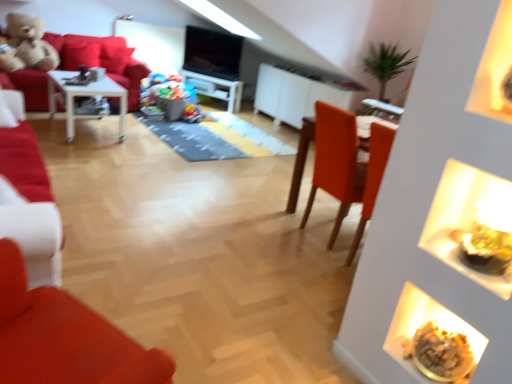
Question: Could you tell me if matte white chair at left is turned towards velvet plush teddy bear at upper left?

Choices:
 (A) no
 (B) yes

Answer: (B)

Question: From a real-world perspective, is matte white chair at left physically above velvet plush teddy bear at upper left?

Choices:
 (A) yes
 (B) no

Answer: (A)

Question: From the image's perspective, is matte white chair at left under velvet plush teddy bear at upper left?

Choices:
 (A) no
 (B) yes

Answer: (B)

Question: Is matte white chair at left far from velvet plush teddy bear at upper left?

Choices:
 (A) yes
 (B) no

Answer: (A)

Question: Is matte white chair at left to the left of velvet plush teddy bear at upper left from the viewer's perspective?

Choices:
 (A) no
 (B) yes

Answer: (A)

Question: Is velvet plush teddy bear at upper left at the back of matte white chair at left?

Choices:
 (A) no
 (B) yes

Answer: (A)

Question: Does white glossy table at left, the first table when ordered from left to right, have a lesser height compared to golden crumbly snack at lower right, the 2th food positioned from the back?

Choices:
 (A) no
 (B) yes

Answer: (A)

Question: From a real-world perspective, is white glossy table at left, acting as the 2th table starting from the bottom, located beneath golden crumbly snack at lower right, marked as the 1th food in a front-to-back arrangement?

Choices:
 (A) no
 (B) yes

Answer: (A)

Question: Is white glossy table at left, which is the 1th table in top-to-bottom order, outside golden crumbly snack at lower right, the 2th food positioned from the back?

Choices:
 (A) yes
 (B) no

Answer: (A)

Question: Considering the relative positions of white glossy table at left, which is the 1th table in top-to-bottom order, and golden crumbly snack at lower right, the 2th food positioned from the back, in the image provided, is white glossy table at left, which is the 1th table in top-to-bottom order, to the left of golden crumbly snack at lower right, the 2th food positioned from the back, from the viewer's perspective?

Choices:
 (A) yes
 (B) no

Answer: (A)

Question: Considering the relative sizes of white glossy table at left, which is the 1th table in top-to-bottom order, and golden crumbly snack at lower right, which is the 1th food from right to left, in the image provided, is white glossy table at left, which is the 1th table in top-to-bottom order, wider than golden crumbly snack at lower right, which is the 1th food from right to left,?

Choices:
 (A) no
 (B) yes

Answer: (B)

Question: Is white glossy table at left, acting as the 2th table starting from the bottom, at the right side of golden crumbly snack at lower right, marked as the 1th food in a front-to-back arrangement?

Choices:
 (A) no
 (B) yes

Answer: (A)

Question: Can you confirm if matte orange table at center, which appears as the second table when viewed from the top, is bigger than matte white chair at left?

Choices:
 (A) no
 (B) yes

Answer: (B)